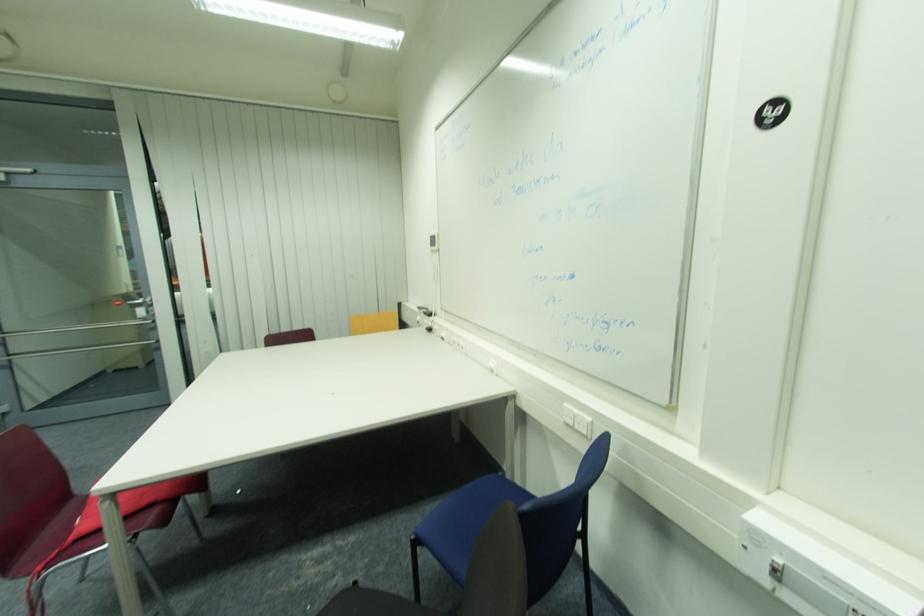
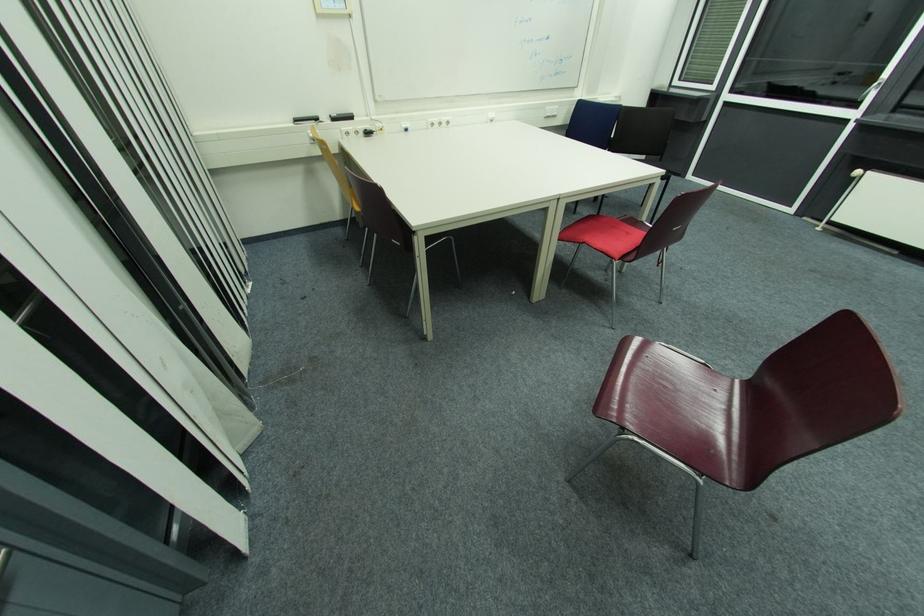
Locate, in the second image, the point that corresponds to (x=429, y=314) in the first image.

(337, 121)